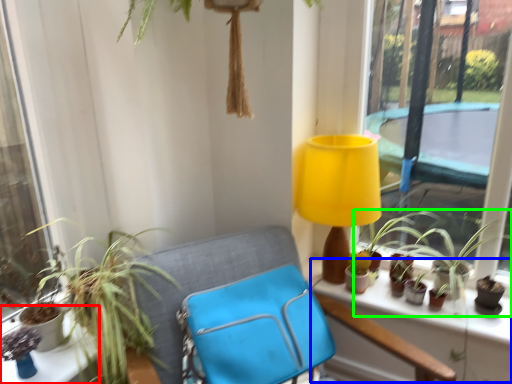
Question: Estimate the real-world distances between objects in this image. Which object is farther from table (highlighted by a red box), window sill (highlighted by a blue box) or houseplant (highlighted by a green box)?

Choices:
 (A) window sill
 (B) houseplant

Answer: (B)